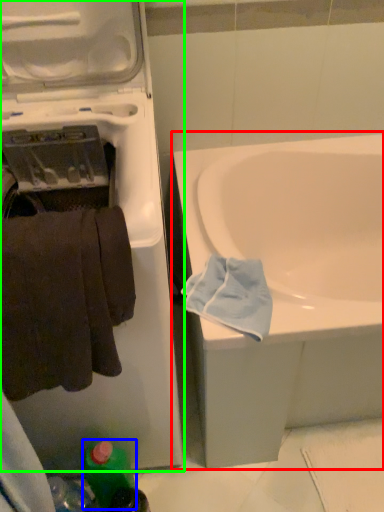
Question: Based on their relative distances, which object is farther from bathtub (highlighted by a red box)? Choose from bottle (highlighted by a blue box) and washing machine (highlighted by a green box).

Choices:
 (A) bottle
 (B) washing machine

Answer: (A)